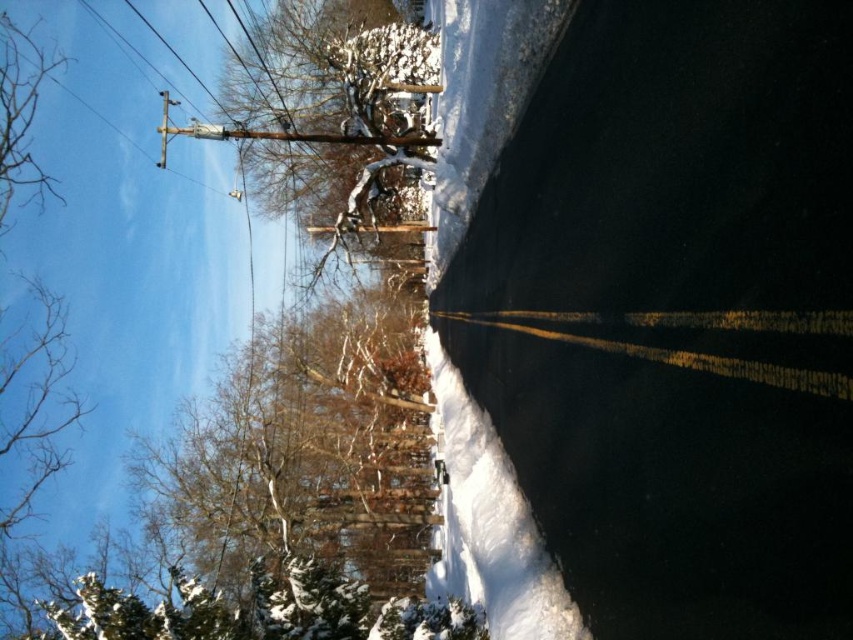
Which of these two, brown textured tree at left or snow-covered tree at upper center, stands taller?

snow-covered tree at upper center

Does brown textured tree at left appear over snow-covered tree at upper center?

No.

Locate an element on the screen. The width and height of the screenshot is (853, 640). brown textured tree at left is located at coordinates (311, 448).